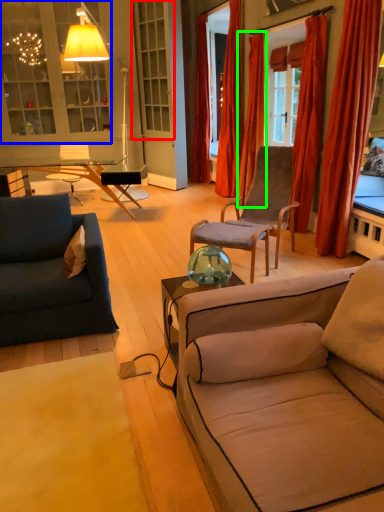
Question: Considering the real-world distances, which object is farthest from window (highlighted by a red box)? cabinetry (highlighted by a blue box) or curtain (highlighted by a green box)?

Choices:
 (A) cabinetry
 (B) curtain

Answer: (B)